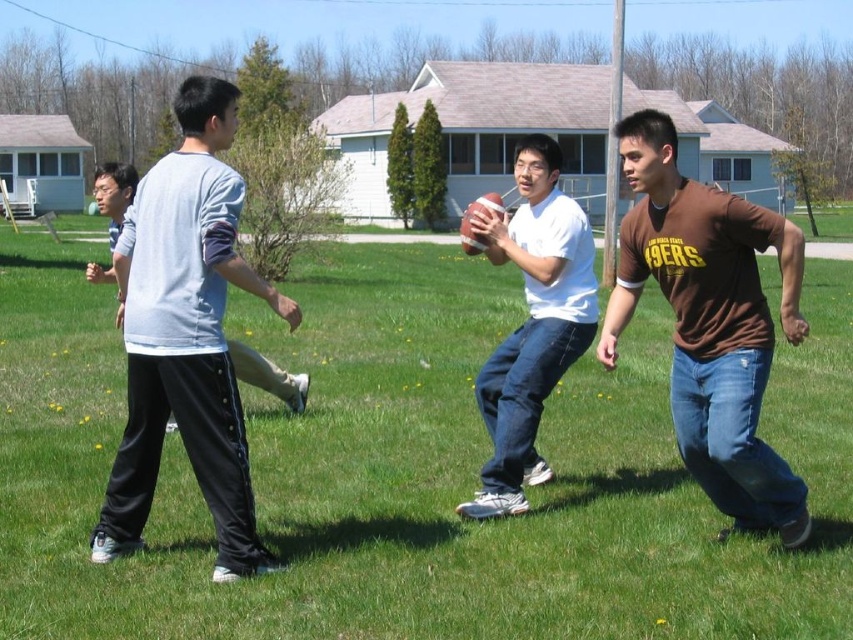
Question: Which of the following is the closest to the observer?

Choices:
 (A) (128, 394)
 (B) (531, 224)
 (C) (747, 316)

Answer: (C)

Question: Does green grass at center appear under white matte shirt at center?

Choices:
 (A) yes
 (B) no

Answer: (A)

Question: Is light blue cotton shirt at left above brown cotton t-shirt at right?

Choices:
 (A) no
 (B) yes

Answer: (A)

Question: Which point is closer to the camera?

Choices:
 (A) green grass at center
 (B) white matte shirt at center
 (C) brown cotton t-shirt at right
 (D) light blue cotton shirt at left

Answer: (A)

Question: Which of the following is the closest to the observer?

Choices:
 (A) (119, 483)
 (B) (788, 339)

Answer: (B)

Question: Is light blue cotton shirt at left above white matte shirt at center?

Choices:
 (A) no
 (B) yes

Answer: (A)